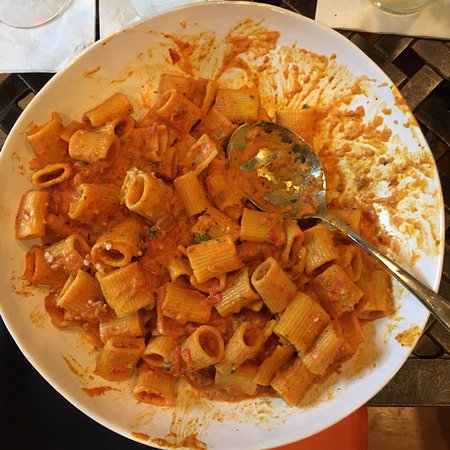
You are a GUI agent. You are given a task and a screenshot of the screen. Output one action in this format:
    pyautogui.click(x=<x>, y=<y>)
    Task: Click on the spoon handle
    The height and width of the screenshot is (450, 450).
    Given the screenshot: What is the action you would take?
    pyautogui.click(x=420, y=291)